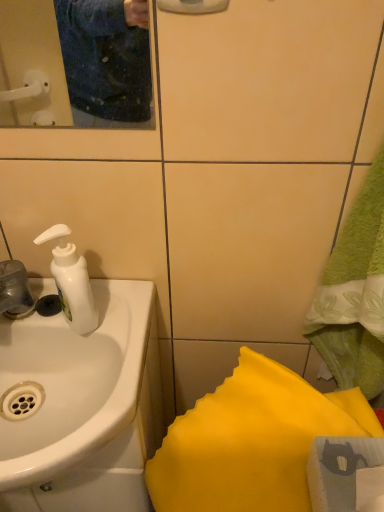
Measure the distance between point (122, 334) and camera.

24.25 inches.

What do you see at coordinates (74, 65) in the screenshot? The height and width of the screenshot is (512, 384). I see `matte plastic mirror at upper left` at bounding box center [74, 65].

Locate an element on the screen. yellow fabric at lower right is located at coordinates (252, 441).

You are a GUI agent. You are given a task and a screenshot of the screen. Output one action in this format:
    pyautogui.click(x=<x>, y=<y>)
    Task: Click on the white glossy sink at left
    
    Given the screenshot: What is the action you would take?
    pyautogui.click(x=83, y=406)

What's the angular difference between yellow fabric at lower right and matte plastic mirror at upper left's facing directions?

They differ by 64.7 degrees in their facing directions.

Locate an element on the screen. bath towel below the matte plastic mirror at upper left (from a real-world perspective) is located at coordinates (252, 441).

Considering the relative sizes of yellow fabric at lower right and matte plastic mirror at upper left in the image provided, is yellow fabric at lower right thinner than matte plastic mirror at upper left?

No.

In the scene shown: Is matte plastic mirror at upper left facing away from yellow fabric at lower right?

matte plastic mirror at upper left does not have its back to yellow fabric at lower right.

Is matte plastic mirror at upper left thinner than yellow fabric at lower right?

Indeed, matte plastic mirror at upper left has a lesser width compared to yellow fabric at lower right.

Visually, is matte plastic mirror at upper left positioned to the left or to the right of yellow fabric at lower right?

Clearly, matte plastic mirror at upper left is on the left of yellow fabric at lower right in the image.

Does matte plastic mirror at upper left come behind yellow fabric at lower right?

No.

Is yellow fabric at lower right situated inside white glossy sink at left or outside?

yellow fabric at lower right is outside white glossy sink at left.

Is point (166, 481) farther from viewer compared to point (98, 355)?

No, (166, 481) is closer to viewer.

Is yellow fabric at lower right oriented towards white glossy sink at left?

Yes, yellow fabric at lower right is facing white glossy sink at left.

Is the surface of white glossy sink at left in direct contact with yellow fabric at lower right?

No, white glossy sink at left is not in contact with yellow fabric at lower right.

Is white glossy sink at left taller or shorter than yellow fabric at lower right?

white glossy sink at left is shorter than yellow fabric at lower right.

Which is more to the right, white glossy sink at left or yellow fabric at lower right?

yellow fabric at lower right is more to the right.

Identify the location of bath towel that is on the right side of white glossy sink at left. This screenshot has width=384, height=512. click(252, 441).

Does point (110, 90) come closer to viewer compared to point (60, 391)?

That is False.

Considering the sizes of objects matte plastic mirror at upper left and white glossy sink at left in the image provided, who is thinner, matte plastic mirror at upper left or white glossy sink at left?

matte plastic mirror at upper left.

Looking at this image, is white glossy sink at left at the back of matte plastic mirror at upper left?

That's not correct — matte plastic mirror at upper left is not looking away from white glossy sink at left.

In the scene shown: Is matte plastic mirror at upper left touching white glossy sink at left?

matte plastic mirror at upper left and white glossy sink at left are clearly separated.

Considering the relative sizes of white glossy sink at left and matte plastic mirror at upper left in the image provided, is white glossy sink at left smaller than matte plastic mirror at upper left?

No, white glossy sink at left is not smaller than matte plastic mirror at upper left.

What are the coordinates of `sink on the right of matte plastic mirror at upper left` in the screenshot? It's located at (83, 406).

From a real-world perspective, is white glossy sink at left over matte plastic mirror at upper left?

No, from a real-world perspective, white glossy sink at left is not on top of matte plastic mirror at upper left.

Is white glossy sink at left with matte plastic mirror at upper left?

No, white glossy sink at left is not next to matte plastic mirror at upper left.

You are a GUI agent. You are given a task and a screenshot of the screen. Output one action in this format:
    pyautogui.click(x=<x>, y=<y>)
    Task: Click on the bath towel behind the matte plastic mirror at upper left
    This screenshot has width=384, height=512.
    Given the screenshot: What is the action you would take?
    pyautogui.click(x=252, y=441)

Locate an element on the screen. bath towel below the matte plastic mirror at upper left (from the image's perspective) is located at coordinates (252, 441).

Based on their spatial positions, is white glossy sink at left or matte plastic mirror at upper left closer to yellow fabric at lower right?

The object closer to yellow fabric at lower right is white glossy sink at left.

When comparing their distances from yellow fabric at lower right, does matte plastic mirror at upper left or white glossy sink at left seem closer?

The object closer to yellow fabric at lower right is white glossy sink at left.

Looking at the image, which one is located closer to white glossy sink at left, matte plastic mirror at upper left or yellow fabric at lower right?

yellow fabric at lower right is closer to white glossy sink at left.

From the image, which object appears to be farther from matte plastic mirror at upper left, yellow fabric at lower right or white glossy sink at left?

The object further to matte plastic mirror at upper left is yellow fabric at lower right.

Estimate the real-world distances between objects in this image. Which object is further from white glossy sink at left, yellow fabric at lower right or matte plastic mirror at upper left?

matte plastic mirror at upper left is further to white glossy sink at left.

Which object lies nearer to the anchor point matte plastic mirror at upper left, white glossy sink at left or yellow fabric at lower right?

Based on the image, white glossy sink at left appears to be nearer to matte plastic mirror at upper left.

Where is `sink between matte plastic mirror at upper left and yellow fabric at lower right in the up-down direction`? The width and height of the screenshot is (384, 512). sink between matte plastic mirror at upper left and yellow fabric at lower right in the up-down direction is located at coordinates 83,406.